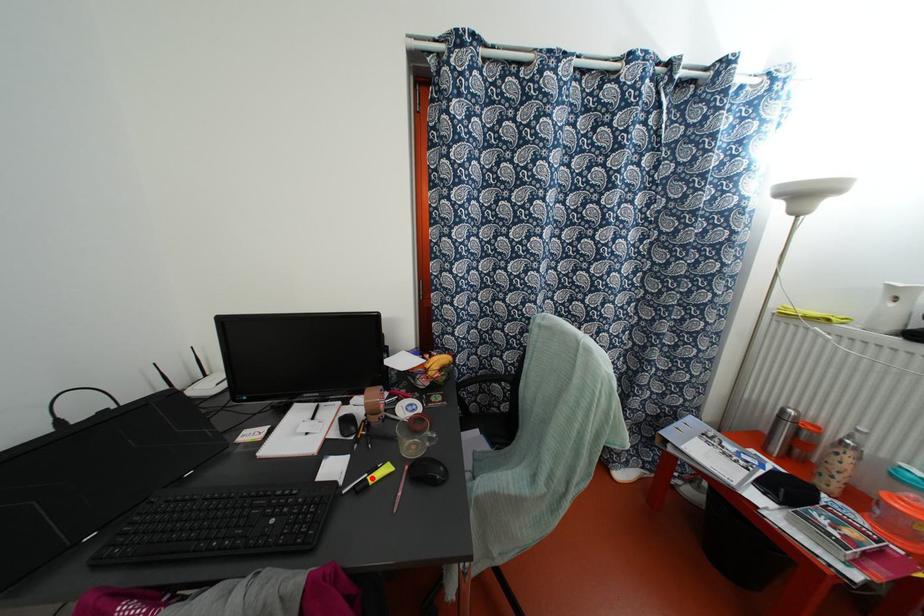
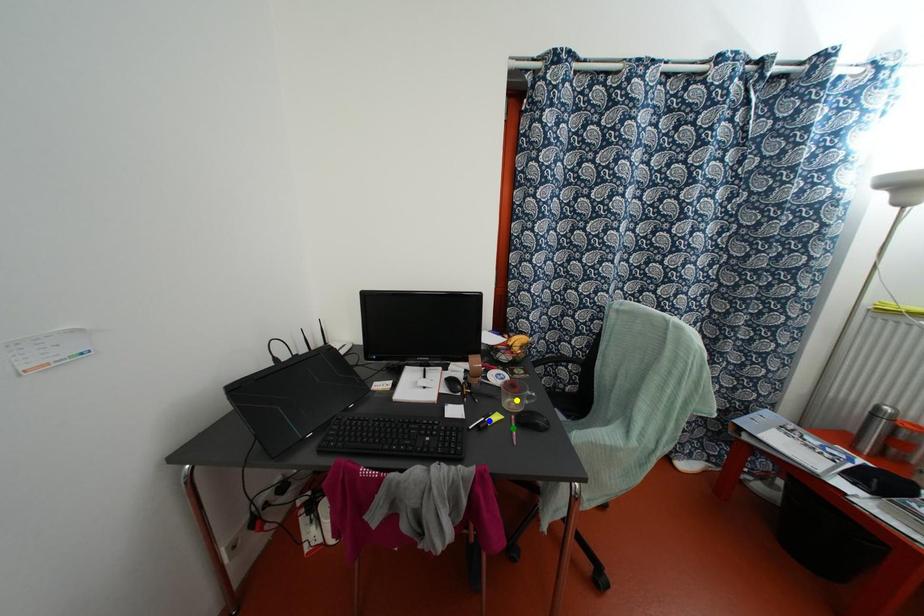
Question: I am providing you with two images of the same scene from different viewpoints. A red point is marked on the first image. You are given multiple points on the second image. Which spot in image 2 lines up with the point in image 1?

Choices:
 (A) blue point
 (B) green point
 (C) yellow point

Answer: (A)